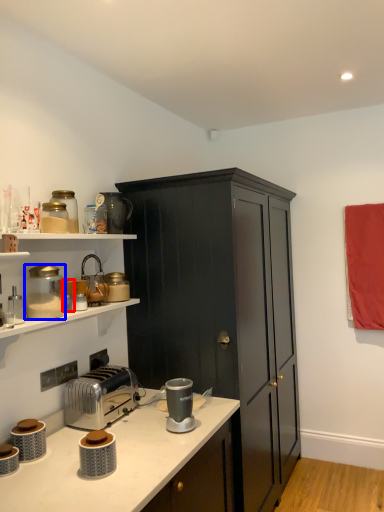
Question: Among these objects, which one is nearest to the camera, appliance (highlighted by a red box) or appliance (highlighted by a blue box)?

Choices:
 (A) appliance
 (B) appliance

Answer: (B)